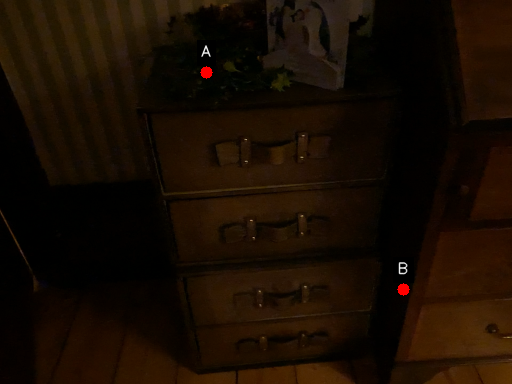
Question: Two points are circled on the image, labeled by A and B beside each circle. Which point is further to the camera?

Choices:
 (A) A is further
 (B) B is further

Answer: (B)